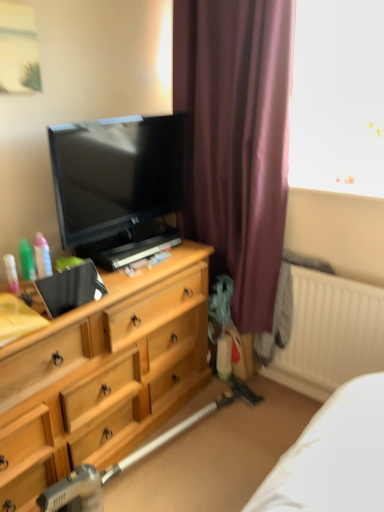
At what (x,y) coordinates should I click in order to perform the action: click on vacant space underneath metallic silver vacuum cleaner at lower center (from a real-world perspective). Please return your answer as a coordinate pair (x, y). This screenshot has width=384, height=512. Looking at the image, I should click on (174, 451).